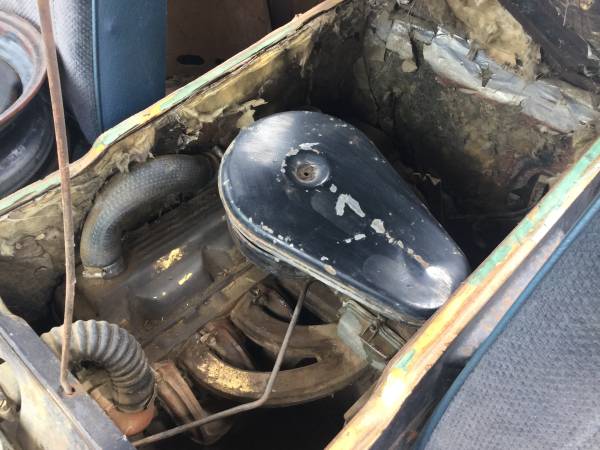
Identify the location of seat cushion. Image resolution: width=600 pixels, height=450 pixels. (529, 363), (74, 52).